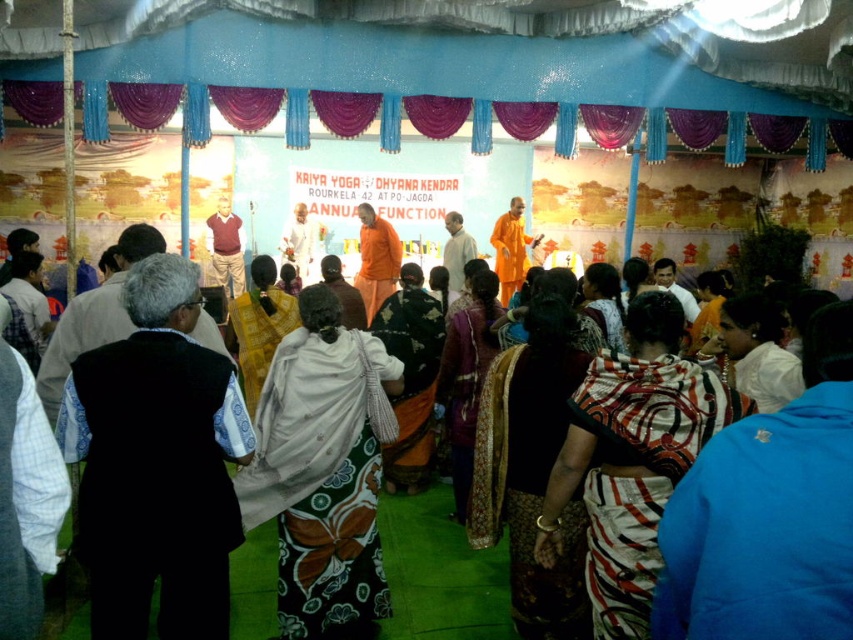
You are attending the annual function and want to compare the length of the black fabric vest at lower left and the orange cloth at center. Which one is longer?

The orange cloth at center is longer than the black fabric vest at lower left.